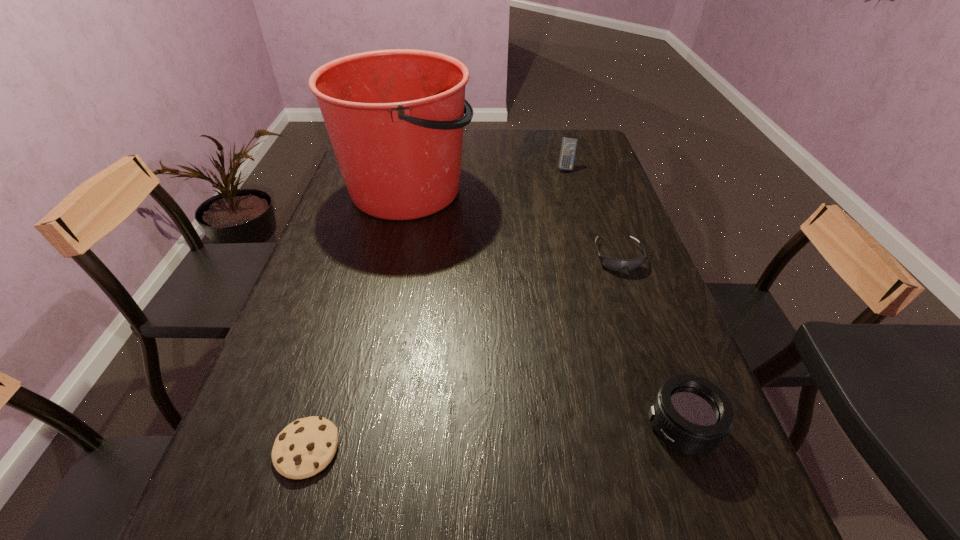
Locate an element on the screen. This screenshot has width=960, height=540. vacant region located 0.400m on the lenses of the third farthest object is located at coordinates (673, 414).

At what (x,y) coordinates should I click in order to perform the action: click on vacant area located 0.120m on the back of the cookie. Please return your answer as a coordinate pair (x, y). This screenshot has width=960, height=540. Looking at the image, I should click on (331, 367).

You are a GUI agent. You are given a task and a screenshot of the screen. Output one action in this format:
    pyautogui.click(x=<x>, y=<y>)
    Task: Click on the object that is at the far edge
    This screenshot has width=960, height=540.
    Given the screenshot: What is the action you would take?
    pyautogui.click(x=395, y=118)

Find the location of a particular element. The width and height of the screenshot is (960, 540). bucket that is at the left edge is located at coordinates (395, 118).

I want to click on cookie that is at the left edge, so click(x=305, y=447).

The width and height of the screenshot is (960, 540). I want to click on calculator present at the right edge, so click(x=568, y=146).

I want to click on telephoto lens that is at the right edge, so (x=692, y=415).

In order to click on goggles that is at the right edge in this screenshot , I will do `click(614, 264)`.

I want to click on object situated at the far left corner, so click(395, 118).

The width and height of the screenshot is (960, 540). I want to click on vacant region at the far edge, so click(553, 158).